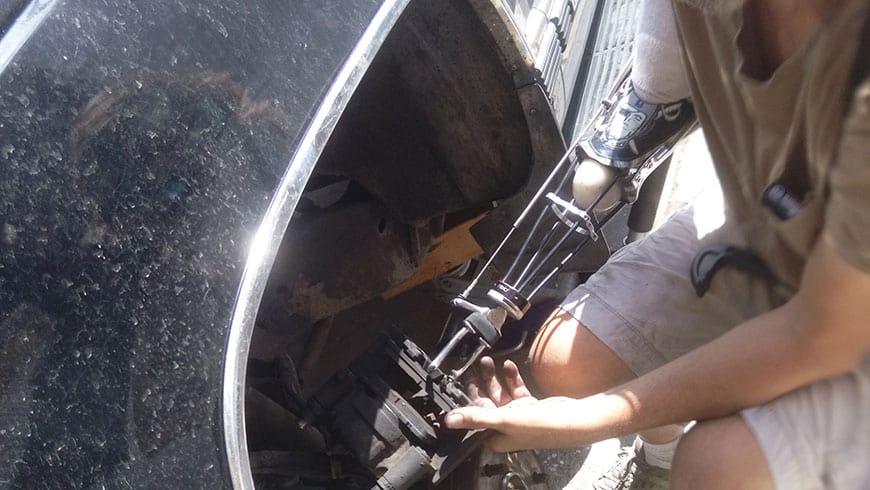
Where is `chest`? The height and width of the screenshot is (490, 870). chest is located at coordinates (787, 25).